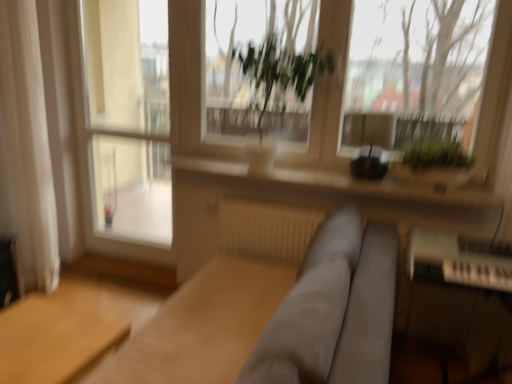
This screenshot has height=384, width=512. Describe the element at coordinates (333, 310) in the screenshot. I see `gray fabric couch at center` at that location.

I want to click on white plastic piano at lower right, so click(x=457, y=303).

Measure the distance between point (132,71) and camera.

Point (132,71) and camera are 3.37 meters apart.

At what (x,y) coordinates should I click in order to perform the action: click on green matte plant at upper center. Please return your answer as a coordinate pair (x, y). Looking at the image, I should click on (424, 66).

The width and height of the screenshot is (512, 384). Describe the element at coordinates (337, 190) in the screenshot. I see `white matte window sill at center` at that location.

Where is `white matte window sill at center`? This screenshot has width=512, height=384. white matte window sill at center is located at coordinates (337, 190).

At what (x,y) coordinates should I click in order to perform the action: click on gray fabric couch at center. Please return your answer as a coordinate pair (x, y). This screenshot has width=512, height=384. Looking at the image, I should click on (333, 310).

Consider the image. From their relative heights in the image, would you say gray fabric couch at center is taller or shorter than white glass screen door at left?

Considering their sizes, gray fabric couch at center has less height than white glass screen door at left.

Considering the relative sizes of gray fabric couch at center and white glass screen door at left in the image provided, is gray fabric couch at center thinner than white glass screen door at left?

No.

How many degrees apart are the facing directions of gray fabric couch at center and white glass screen door at left?

They differ by 0.424 degrees in their facing directions.

Is gray fabric couch at center oriented away from white glass screen door at left?

No, gray fabric couch at center is not facing away from white glass screen door at left.

From the image's perspective, which one is positioned higher, white fabric curtain at left or green matte plant at upper center?

From the image's view, green matte plant at upper center is above.

Who is taller, white fabric curtain at left or green matte plant at upper center?

With more height is white fabric curtain at left.

Does white fabric curtain at left have a lesser width compared to green matte plant at upper center?

No.

What's the angular difference between white fabric curtain at left and green matte plant at upper center's facing directions?

The angle between the facing direction of white fabric curtain at left and the facing direction of green matte plant at upper center is 0.000198 degrees.

How many degrees apart are the facing directions of green matte plant at upper center and green leafy plant at center, the second vegetation viewed from the right?

There is a 0.854-degree angle between the facing directions of green matte plant at upper center and green leafy plant at center, the second vegetation viewed from the right.

Considering the points (230, 9) and (309, 63), which point is in front, point (230, 9) or point (309, 63)?

The point (309, 63) is in front.

Is green matte plant at upper center positioned beyond the bounds of green leafy plant at center, marked as the first vegetation in a left-to-right arrangement?

Yes, green matte plant at upper center is not within green leafy plant at center, marked as the first vegetation in a left-to-right arrangement.

From the image's perspective, is green matte plant at upper center above green leafy plant at center, marked as the first vegetation in a left-to-right arrangement?

Yes, from the image's perspective, green matte plant at upper center is over green leafy plant at center, marked as the first vegetation in a left-to-right arrangement.

From the image's perspective, is white glass screen door at left located beneath white fabric curtain at left?

No.

Identify the location of screen door on the right of white fabric curtain at left. (129, 117).

Is white glass screen door at left thinner than white fabric curtain at left?

Yes.

How different are the orientations of white glass screen door at left and white fabric curtain at left in degrees?

They differ by 0.000336 degrees in their facing directions.

Is white matte window sill at center positioned far away from green leafy plant at center, marked as the first vegetation in a left-to-right arrangement?

white matte window sill at center is positioned a significant distance from green leafy plant at center, marked as the first vegetation in a left-to-right arrangement.

Locate an element on the screen. Image resolution: width=512 pixels, height=384 pixels. window sill that is behind the green leafy plant at center, marked as the first vegetation in a left-to-right arrangement is located at coordinates (337, 190).

Which object is positioned more to the right, white matte window sill at center or green leafy plant at center, the second vegetation viewed from the right?

Positioned to the right is white matte window sill at center.

In terms of height, does white matte window sill at center look taller or shorter compared to green leafy plant at center, marked as the first vegetation in a left-to-right arrangement?

white matte window sill at center is shorter than green leafy plant at center, marked as the first vegetation in a left-to-right arrangement.

From a real-world perspective, which object stands above the other?

green leafy plant at upper right, which is the 1th vegetation from right to left, is physically above.

Which object is closer to the camera taking this photo, green leafy plant at upper right, the 2th vegetation viewed from the left, or light brown wooden table at lower left?

light brown wooden table at lower left is more forward.

Which point is more distant from viewer, (447, 141) or (17, 351)?

The point (447, 141) is farther.

Who is taller, green leafy plant at center, the second vegetation viewed from the right, or gray fabric couch at center?

green leafy plant at center, the second vegetation viewed from the right.

Does green leafy plant at center, marked as the first vegetation in a left-to-right arrangement, have a lesser width compared to gray fabric couch at center?

Incorrect, the width of green leafy plant at center, marked as the first vegetation in a left-to-right arrangement, is not less than that of gray fabric couch at center.

From a real-world perspective, is green leafy plant at center, the second vegetation viewed from the right, located beneath gray fabric couch at center?

No, from a real-world perspective, green leafy plant at center, the second vegetation viewed from the right, is not below gray fabric couch at center.

Based on the photo, is gray fabric couch at center inside green leafy plant at center, marked as the first vegetation in a left-to-right arrangement?

No, gray fabric couch at center is located outside of green leafy plant at center, marked as the first vegetation in a left-to-right arrangement.

Where is `studio couch that appears on the right of white glass screen door at left`? The height and width of the screenshot is (384, 512). studio couch that appears on the right of white glass screen door at left is located at coordinates (333, 310).

Where is `curtain behind the green matte plant at upper center`? This screenshot has width=512, height=384. curtain behind the green matte plant at upper center is located at coordinates (28, 143).

From the image, which object appears to be nearer to green matte plant at upper center, white fabric curtain at left or green leafy plant at center, marked as the first vegetation in a left-to-right arrangement?

The object closer to green matte plant at upper center is green leafy plant at center, marked as the first vegetation in a left-to-right arrangement.

Which object lies further to the anchor point green matte plant at upper center, white matte window sill at center or white fabric curtain at left?

Based on the image, white fabric curtain at left appears to be further to green matte plant at upper center.

Based on their spatial positions, is green matte plant at upper center or white fabric curtain at left further from white glass screen door at left?

Based on the image, green matte plant at upper center appears to be further to white glass screen door at left.

Based on the photo, looking at the image, which one is located closer to gray fabric couch at center, green leafy plant at center, the second vegetation viewed from the right, or white fabric curtain at left?

white fabric curtain at left lies closer to gray fabric couch at center than the other object.

Looking at this image, when comparing their distances from gray fabric couch at center, does white fabric curtain at left or green leafy plant at upper right, which is the 1th vegetation from right to left, seem further?

The object further to gray fabric couch at center is white fabric curtain at left.

Looking at the image, which one is located closer to white matte window sill at center, light brown wooden table at lower left or white fabric curtain at left?

Among the two, light brown wooden table at lower left is located nearer to white matte window sill at center.

Which object lies nearer to the anchor point white plastic piano at lower right, green leafy plant at upper right, the 2th vegetation viewed from the left, or white fabric curtain at left?

Among the two, green leafy plant at upper right, the 2th vegetation viewed from the left, is located nearer to white plastic piano at lower right.

Which object lies nearer to the anchor point light brown wooden table at lower left, green matte plant at upper center or white glass screen door at left?

white glass screen door at left is closer to light brown wooden table at lower left.

Find the location of `screen door between white fabric curtain at left and green matte plant at upper center in the horizontal direction`. screen door between white fabric curtain at left and green matte plant at upper center in the horizontal direction is located at coordinates (129, 117).

At what (x,y) coordinates should I click in order to perform the action: click on screen door between light brown wooden table at lower left and gray fabric couch at center in the horizontal direction. Please return your answer as a coordinate pair (x, y). Looking at the image, I should click on (129, 117).

The height and width of the screenshot is (384, 512). I want to click on screen door between white fabric curtain at left and white matte window sill at center in the horizontal direction, so click(x=129, y=117).

Locate an element on the screen. The width and height of the screenshot is (512, 384). table between white fabric curtain at left and green leafy plant at center, marked as the first vegetation in a left-to-right arrangement, in the horizontal direction is located at coordinates (53, 340).